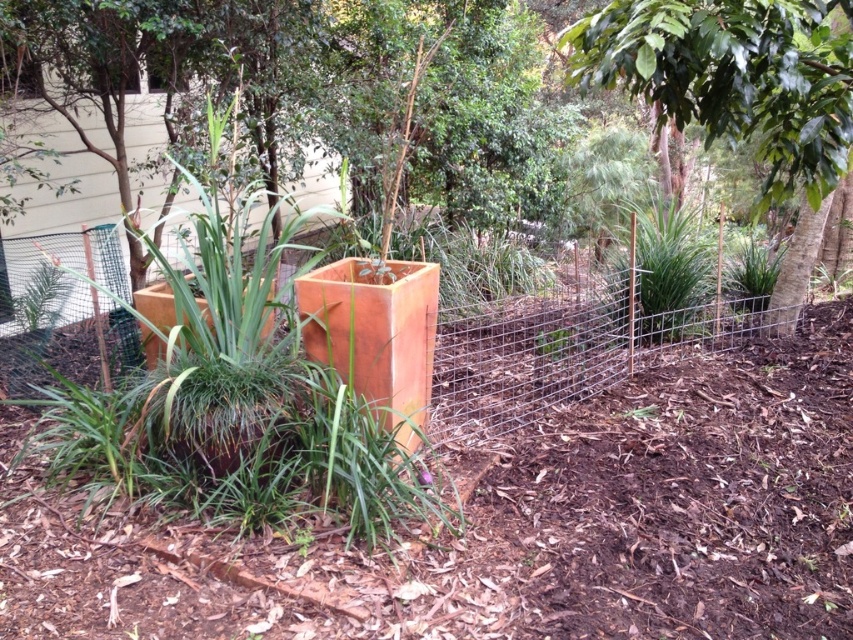
You are a gardener who wants to plant a new flower that requires at least 30 cm of space above it to grow properly. You have two options in the garden scene shown. Which object between the rusty metal planter at center and the green grass at center would provide enough vertical space for the flower?

The rusty metal planter at center has a greater height compared to the green grass at center, so it would provide enough vertical space for the flower that requires at least 30 cm of space above it.

You are a gardener who needs to place a new 3.5 feet wide decorative statue between the green leafy tree at center and the matte orange planter at center. Will there be enough space to place it without moving either object?

The distance between the green leafy tree at center and the matte orange planter at center is 8.45 feet. Since the statue is 3.5 feet wide, there is sufficient space to place it between them as 3.5 feet is less than 8.45 feet.

You are a gardener who wants to prune the green leafy tree at center and the rusty metal planter at center. Which object requires a ladder to reach its top?

The rusty metal planter at center requires a ladder to reach its top because it has a greater height than the green leafy tree at center.